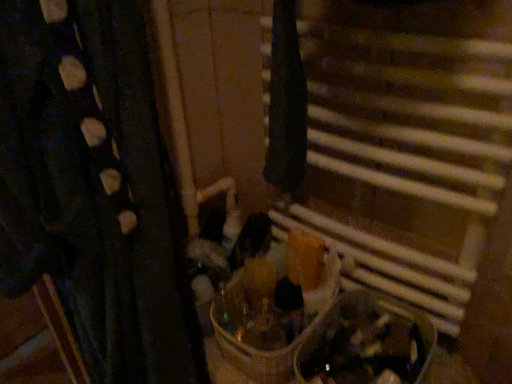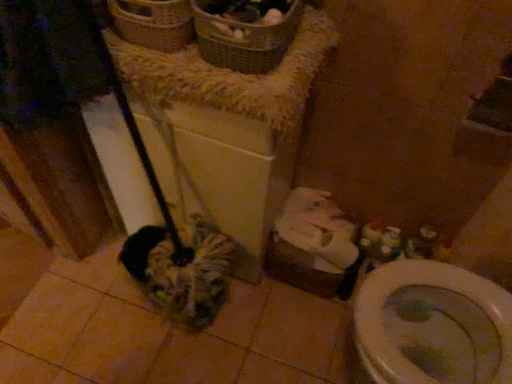
Question: How did the camera likely rotate when shooting the video?

Choices:
 (A) rotated left
 (B) rotated right

Answer: (B)